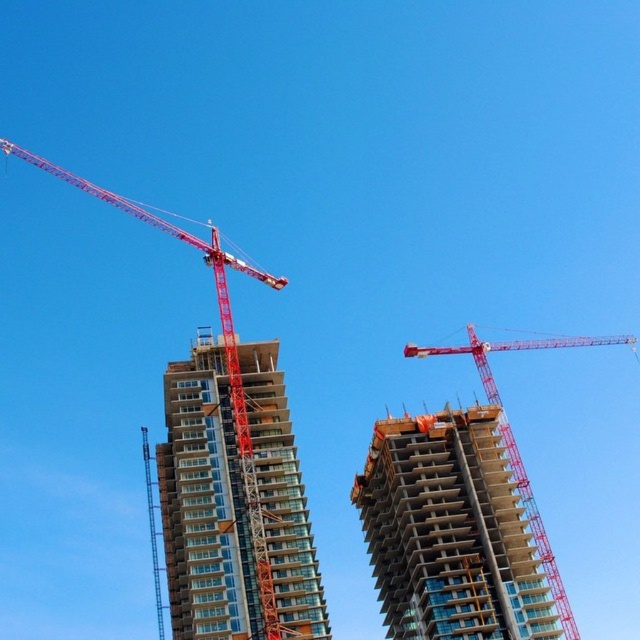
Is glassy concrete building at center thinner than red metal crane at upper left?

Yes.

Is glassy concrete building at center below red metal crane at upper left?

Yes.

Which is behind, point (292, 600) or point (230, 410)?

The point (230, 410) is behind.

The height and width of the screenshot is (640, 640). What are the coordinates of `glassy concrete building at center` in the screenshot? It's located at (204, 502).

Does concrete building at center have a lesser width compared to red metal crane at upper left?

Correct, concrete building at center's width is less than red metal crane at upper left's.

Is point (388, 422) positioned in front of point (12, 147)?

Yes, point (388, 422) is in front of point (12, 147).

Is point (372, 480) less distant than point (228, 337)?

No, it is not.

At what (x,y) coordinates should I click in order to perform the action: click on concrete building at center. Please return your answer as a coordinate pair (x, y). The height and width of the screenshot is (640, 640). Looking at the image, I should click on (449, 531).

Which of these two, glassy concrete building at center or concrete building at center, stands taller?

glassy concrete building at center is taller.

Which is behind, point (173, 365) or point (481, 532)?

The point (173, 365) is behind.

The height and width of the screenshot is (640, 640). I want to click on glassy concrete building at center, so click(204, 502).